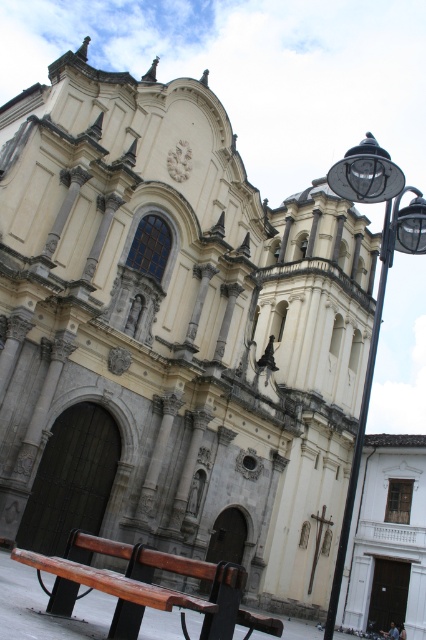
You are planning to install a new bench that is 4 feet wide between the wooden bench at lower left and the black metal streetlight at right. Is there enough space to place it without moving either existing object?

The distance between the wooden bench at lower left and the black metal streetlight at right is 87.23 feet. Since the new bench is only 4 feet wide, there is ample space to place it between them without needing to move either existing object.

You are planning to install a new lamppost between the wooden bench at lower left and the existing lamppost to the right of the church. The new lamppost requires a 2.5 meter space on all sides. Is there enough space between them for installation?

The distance between the wooden bench at lower left and the existing lamppost to the right of the church is 24.91 meters. Subtracting the required 2.5 meters on each side for the new lamppost, there would still be 24.91 minus 5 equals 19.91 meters remaining. This is more than enough space to install the new lamppost between them.